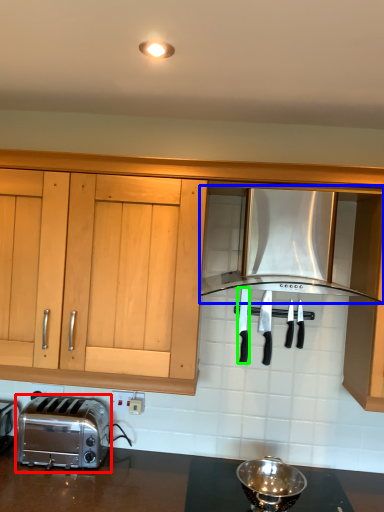
Question: Estimate the real-world distances between objects in this image. Which object is farther from toaster (highlighted by a red box), kitchen appliance (highlighted by a blue box) or silverware (highlighted by a green box)?

Choices:
 (A) kitchen appliance
 (B) silverware

Answer: (A)